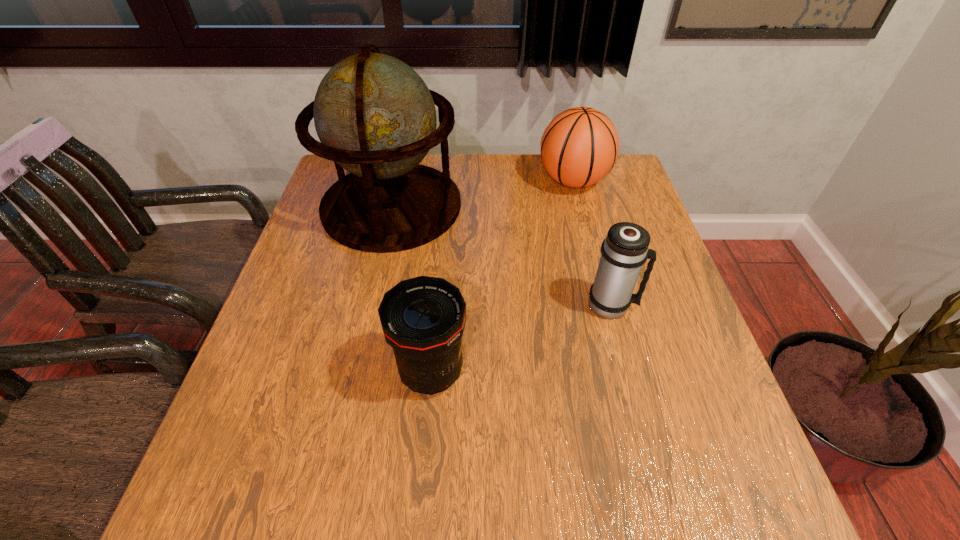
Image resolution: width=960 pixels, height=540 pixels. What are the coordinates of `free spot between the globe and the basketball` in the screenshot? It's located at (483, 193).

Where is `free space that is in between the tallest object and the basketball`? Image resolution: width=960 pixels, height=540 pixels. free space that is in between the tallest object and the basketball is located at coordinates (483, 193).

Image resolution: width=960 pixels, height=540 pixels. Identify the location of vacant space that is in between the basketball and the third farthest object. (592, 242).

Locate an element on the screen. Image resolution: width=960 pixels, height=540 pixels. blank region between the basketball and the globe is located at coordinates (483, 193).

Identify the location of unoccupied area between the tallest object and the thermos bottle. (502, 255).

The image size is (960, 540). I want to click on free space between the nearest object and the thermos bottle, so click(x=521, y=339).

The width and height of the screenshot is (960, 540). Find the location of `unoccupied position between the thermos bottle and the basketball`. unoccupied position between the thermos bottle and the basketball is located at coordinates (592, 242).

Find the location of a particular element. The image size is (960, 540). free space between the third farthest object and the basketball is located at coordinates click(x=592, y=242).

The height and width of the screenshot is (540, 960). What are the coordinates of `the closest object to the second nearest object` in the screenshot? It's located at (423, 318).

Locate an element on the screen. The width and height of the screenshot is (960, 540). object that stands as the second closest to the tallest object is located at coordinates (423, 318).